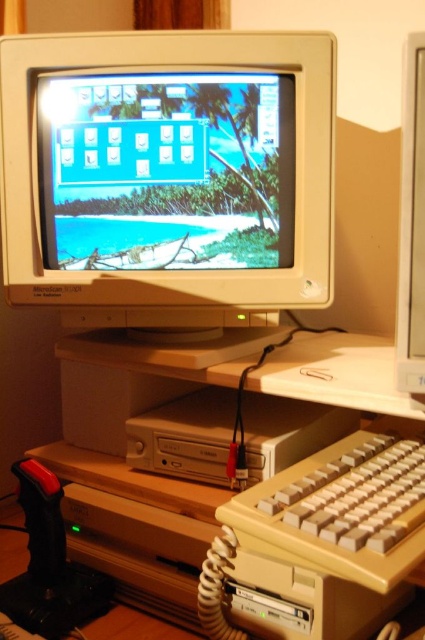
Question: Which point appears closest to the camera in this image?

Choices:
 (A) click(x=161, y=314)
 (B) click(x=411, y=88)
 (C) click(x=410, y=468)
 (D) click(x=357, y=600)

Answer: (B)

Question: Among these points, which one is farthest from the camera?

Choices:
 (A) [272, 342]
 (B) [139, 141]
 (C) [422, 109]
 (D) [172, 408]

Answer: (A)

Question: Is matte plastic monitor at center bigger than matte plastic monitor at right?

Choices:
 (A) no
 (B) yes

Answer: (B)

Question: Considering the real-world distances, which object is closest to the matte plastic monitor at center?

Choices:
 (A) wooden at center
 (B) white plastic cd-rom drive at center

Answer: (A)

Question: Considering the relative positions of matte plastic monitor at center and beige plastic keyboard at lower center in the image provided, where is matte plastic monitor at center located with respect to beige plastic keyboard at lower center?

Choices:
 (A) left
 (B) right

Answer: (A)

Question: Can you confirm if matte plastic monitor at center is bigger than beige plastic keyboard at lower center?

Choices:
 (A) yes
 (B) no

Answer: (A)